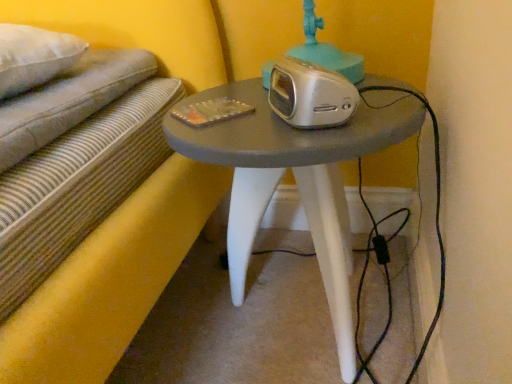
Question: Does matte gray table at center have a lesser height compared to silver metallic alarm clock at center?

Choices:
 (A) yes
 (B) no

Answer: (B)

Question: Does matte gray table at center have a lesser width compared to silver metallic alarm clock at center?

Choices:
 (A) yes
 (B) no

Answer: (B)

Question: Does matte gray table at center have a smaller size compared to silver metallic alarm clock at center?

Choices:
 (A) yes
 (B) no

Answer: (B)

Question: Is matte gray table at center oriented towards silver metallic alarm clock at center?

Choices:
 (A) yes
 (B) no

Answer: (B)

Question: Is matte gray table at center turned away from silver metallic alarm clock at center?

Choices:
 (A) no
 (B) yes

Answer: (A)

Question: Is matte gray table at center not within silver metallic alarm clock at center?

Choices:
 (A) no
 (B) yes

Answer: (B)

Question: Considering the relative sizes of silver metallic alarm clock at center and matte gray table at center in the image provided, is silver metallic alarm clock at center wider than matte gray table at center?

Choices:
 (A) no
 (B) yes

Answer: (A)

Question: Can you confirm if silver metallic alarm clock at center is positioned to the right of matte gray table at center?

Choices:
 (A) yes
 (B) no

Answer: (B)

Question: Is silver metallic alarm clock at center bigger than matte gray table at center?

Choices:
 (A) yes
 (B) no

Answer: (B)

Question: Is silver metallic alarm clock at center smaller than matte gray table at center?

Choices:
 (A) yes
 (B) no

Answer: (A)

Question: Is the depth of silver metallic alarm clock at center greater than that of matte gray table at center?

Choices:
 (A) yes
 (B) no

Answer: (A)

Question: Does silver metallic alarm clock at center have a greater height compared to matte gray table at center?

Choices:
 (A) yes
 (B) no

Answer: (B)

Question: Would you say matte gray table at center is to the left or to the right of silver metallic alarm clock at center in the picture?

Choices:
 (A) left
 (B) right

Answer: (B)